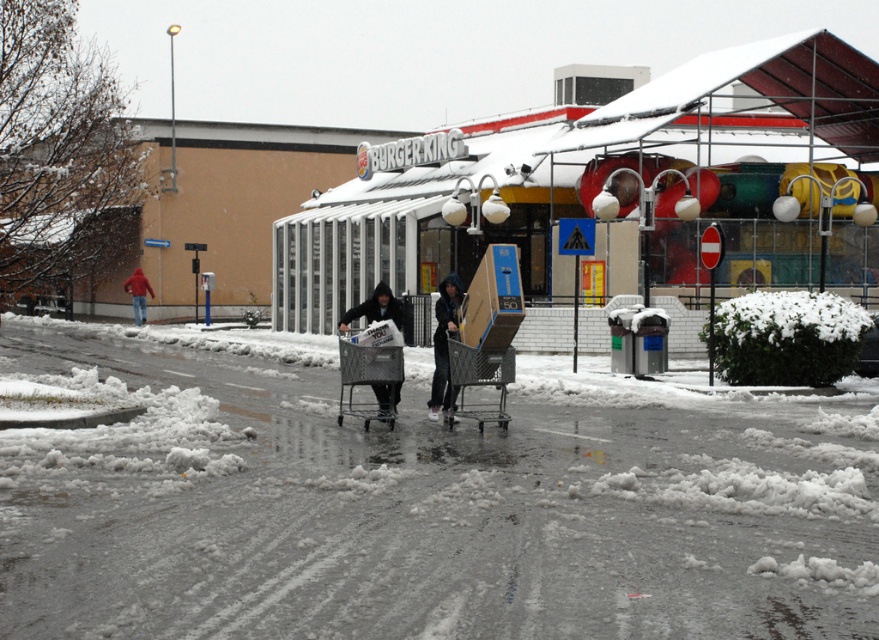
How much distance is there between snowy asphalt pavement at center and metallic gray shopping cart at center?

snowy asphalt pavement at center and metallic gray shopping cart at center are 8.49 feet apart.

Can you confirm if snowy asphalt pavement at center is positioned to the left of metallic gray shopping cart at center?

In fact, snowy asphalt pavement at center is to the right of metallic gray shopping cart at center.

Who is more distant from viewer, (x=149, y=563) or (x=447, y=342)?

The point (x=447, y=342) is more distant.

I want to click on snowy asphalt pavement at center, so click(x=416, y=513).

Can you confirm if metallic gray shopping cart at center is shorter than dark gray hoodie at center?

No.

Is point (466, 364) closer to camera compared to point (449, 333)?

Yes, point (466, 364) is in front of point (449, 333).

Locate an element on the screen. This screenshot has height=640, width=879. metallic gray shopping cart at center is located at coordinates (478, 380).

Between point (453, 312) and point (139, 307), which one is positioned in front?

Point (453, 312) is in front.

Image resolution: width=879 pixels, height=640 pixels. What do you see at coordinates (444, 346) in the screenshot?
I see `dark gray hoodie at center` at bounding box center [444, 346].

The width and height of the screenshot is (879, 640). Find the location of `dark gray hoodie at center`. dark gray hoodie at center is located at coordinates (444, 346).

Find the location of `dark gray hoodie at center`. dark gray hoodie at center is located at coordinates (444, 346).